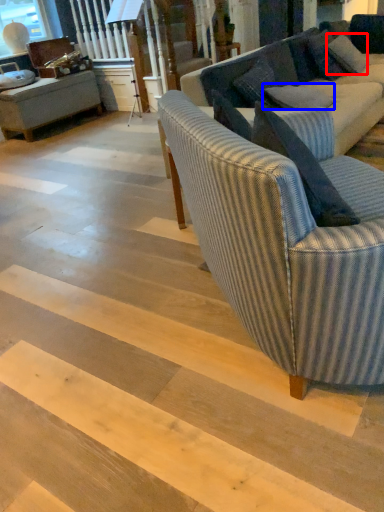
Question: Which point is closer to the camera, pillow (highlighted by a red box) or pillow (highlighted by a blue box)?

Choices:
 (A) pillow
 (B) pillow

Answer: (B)